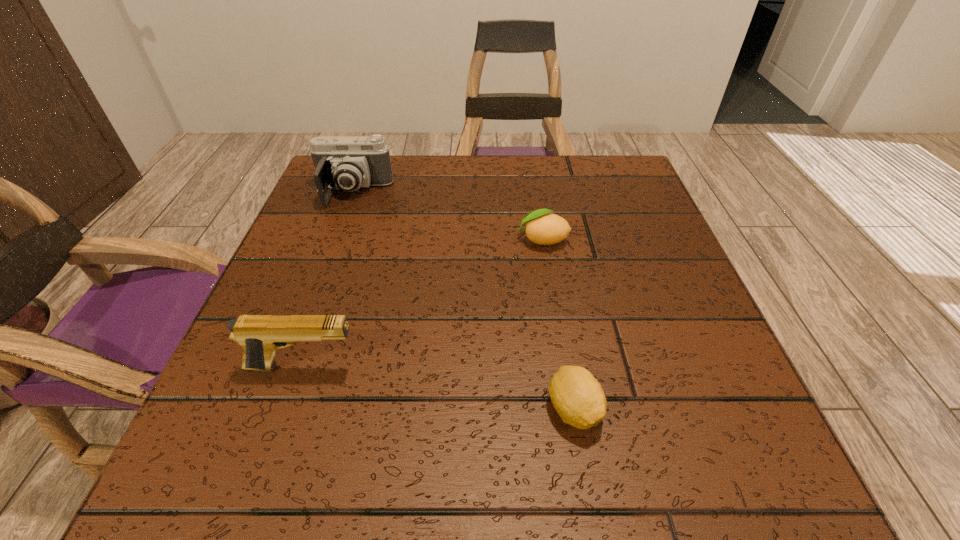
Locate an element on the screen. vacant region between the pistol and the third nearest object is located at coordinates (422, 303).

What are the coordinates of `vacant region between the nearest object and the third farthest object` in the screenshot? It's located at (439, 388).

You are a GUI agent. You are given a task and a screenshot of the screen. Output one action in this format:
    pyautogui.click(x=<x>, y=<y>)
    Task: Click on the free space between the farthest object and the pistol
    
    Given the screenshot: What is the action you would take?
    pyautogui.click(x=328, y=280)

Where is `empty space between the third nearest object and the nearest object`? empty space between the third nearest object and the nearest object is located at coordinates (558, 325).

Where is `free area in between the farther lemon and the farthest object`? free area in between the farther lemon and the farthest object is located at coordinates (447, 217).

The height and width of the screenshot is (540, 960). I want to click on free space between the pistol and the farthest object, so click(328, 280).

Where is `empty location between the nearest object and the camera`? This screenshot has height=540, width=960. empty location between the nearest object and the camera is located at coordinates (464, 301).

What are the coordinates of `free space between the nearer lemon and the second nearest object` in the screenshot? It's located at (439, 388).

Locate an element on the screen. vacant area that lies between the third nearest object and the nearest object is located at coordinates (558, 325).

Identify the location of empty location between the third farthest object and the farthest object. The width and height of the screenshot is (960, 540). (328, 280).